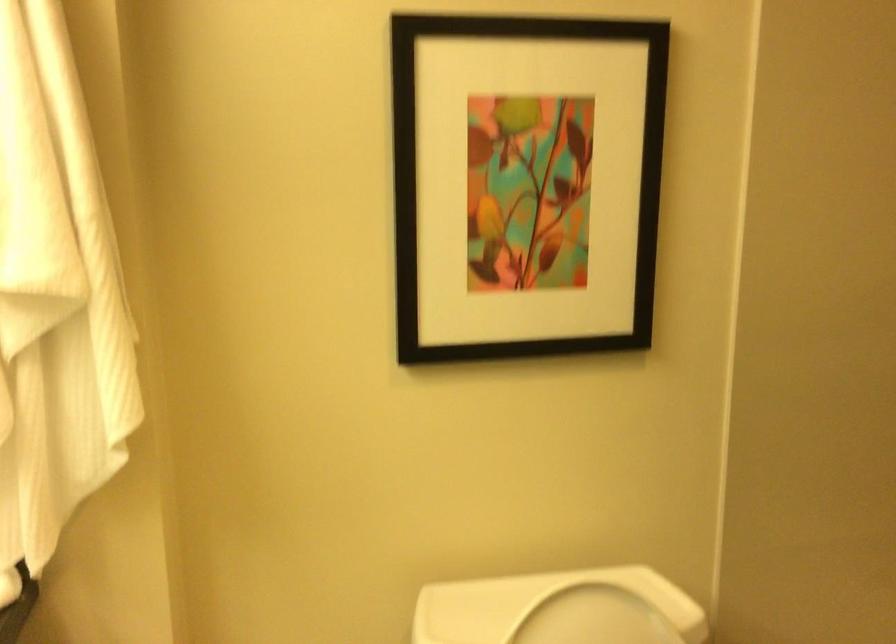
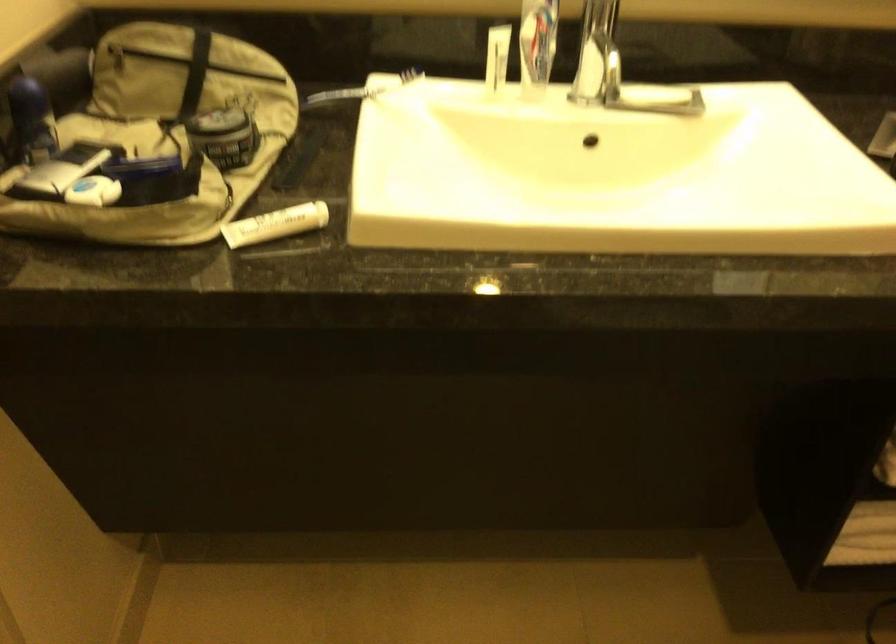
The images are taken continuously from a first-person perspective. In which direction is your viewpoint rotating?

The camera rotated toward left-down.